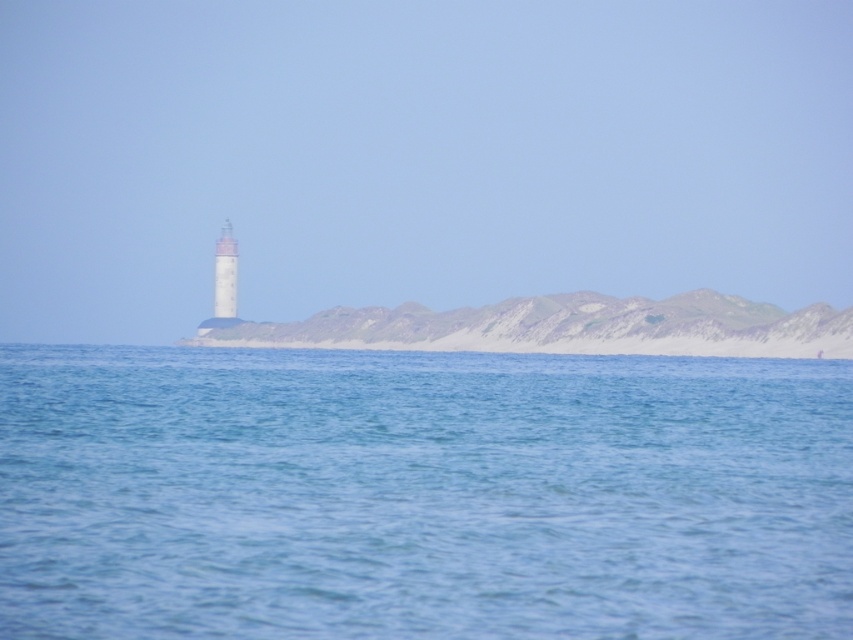
Question: Which object appears closest to the camera in this image?

Choices:
 (A) blue water at center
 (B) white textured lighthouse at center
 (C) white glossy tower at center

Answer: (A)

Question: Is white textured lighthouse at center to the right of white glossy tower at center from the viewer's perspective?

Choices:
 (A) no
 (B) yes

Answer: (A)

Question: Which of the following is the closest to the observer?

Choices:
 (A) (337, 417)
 (B) (215, 314)
 (C) (227, 269)
 (D) (373, 333)

Answer: (A)

Question: Can you confirm if blue water at center is wider than white textured lighthouse at center?

Choices:
 (A) no
 (B) yes

Answer: (B)

Question: Does rugged sand dunes at center appear on the right side of white glossy tower at center?

Choices:
 (A) no
 (B) yes

Answer: (B)

Question: Which point is closer to the camera taking this photo?

Choices:
 (A) (218, 316)
 (B) (231, 284)
 (C) (357, 317)
 (D) (195, 376)

Answer: (D)